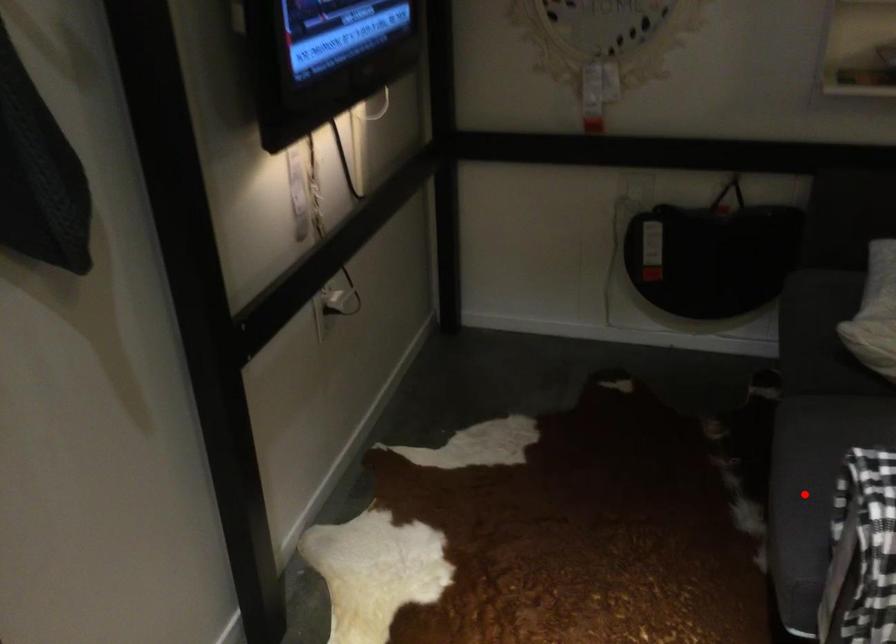
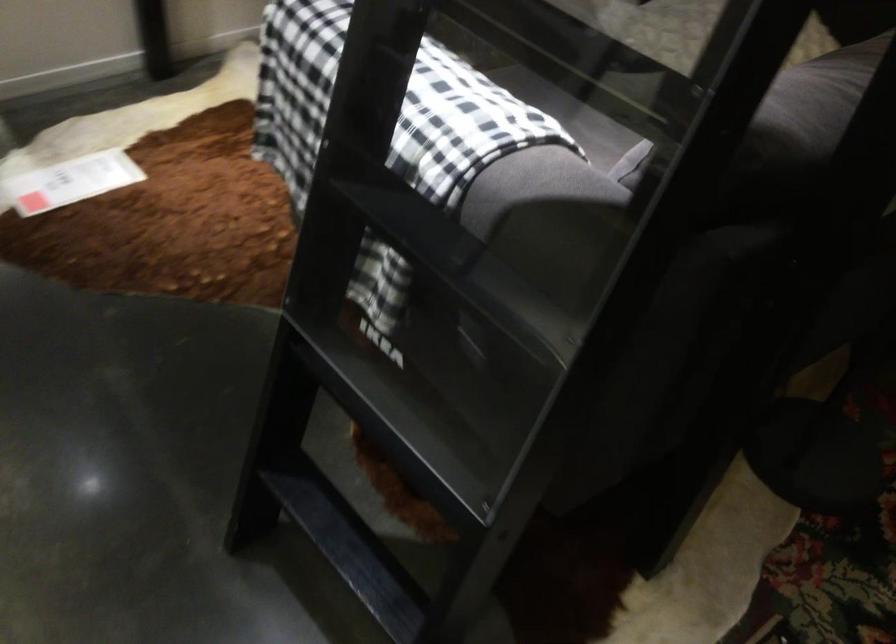
Question: I am providing you with two images of the same scene from different viewpoints. A red point is marked on the first image. At the location where the point appears in image 1, is it still visible in image 2?

Choices:
 (A) Yes
 (B) No

Answer: (B)